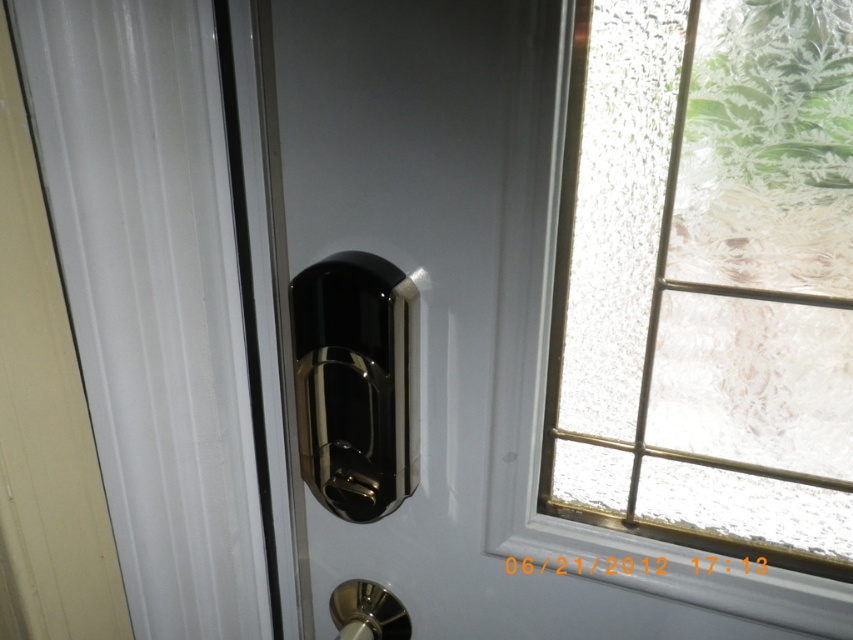
You are a delivery person trying to unlock the glossy metallic lock at center on a modern door. Your key is 15 centimeters long. Can you reach the lock from your current position without moving closer?

The glossy metallic lock at center is 47.67 centimeters away from the viewer. Since the key is only 15 centimeters long, it is not long enough to reach the lock from the current distance. You will need to move closer to unlock it.

You are trying to open the door and need to locate the handle. Based on the image, which object is positioned to the left of the other between the glossy metallic lock at center and the polished metal door handle at lower center?

The polished metal door handle at lower center is positioned to the left of the glossy metallic lock at center.

You are trying to unlock the door and need to reach the glossy metallic door handle at center. However, there is a glossy metallic lock at center blocking your view. Can you still access the door handle?

The glossy metallic lock at center is in front of the glossy metallic door handle at center, so you cannot access the door handle directly as the lock is blocking it.